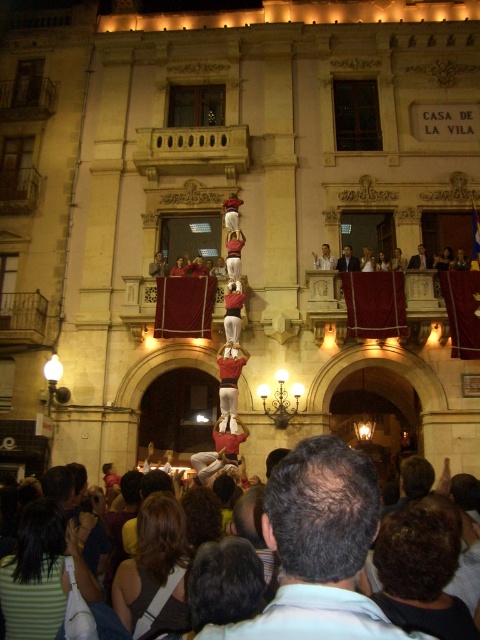
Question: Does smooth white shirt at upper center lie in front of smooth skin man at center?

Choices:
 (A) no
 (B) yes

Answer: (A)

Question: Which of the following is the closest to the observer?

Choices:
 (A) (415, 256)
 (B) (236, 380)
 (C) (307, 552)

Answer: (C)

Question: Which object is positioned farthest from the red fabric human at center?

Choices:
 (A) smooth skin man at center
 (B) gray hair at center

Answer: (A)

Question: Is gray hair at center bigger than smooth white shirt at upper center?

Choices:
 (A) no
 (B) yes

Answer: (B)

Question: Which of the following is the closest to the observer?

Choices:
 (A) (432, 262)
 (B) (237, 392)

Answer: (B)

Question: Can you confirm if red fabric human at center is positioned to the left of smooth white shirt at upper center?

Choices:
 (A) no
 (B) yes

Answer: (B)